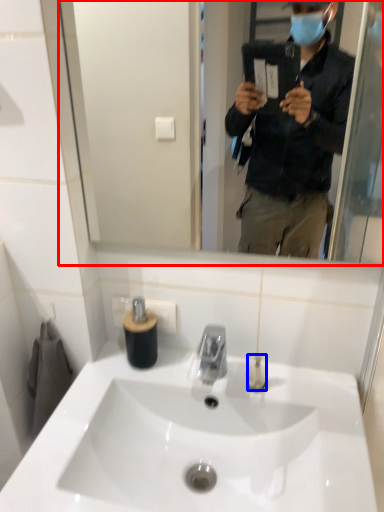
Question: Which point is further to the camera, mirror (highlighted by a red box) or toiletry (highlighted by a blue box)?

Choices:
 (A) mirror
 (B) toiletry

Answer: (B)